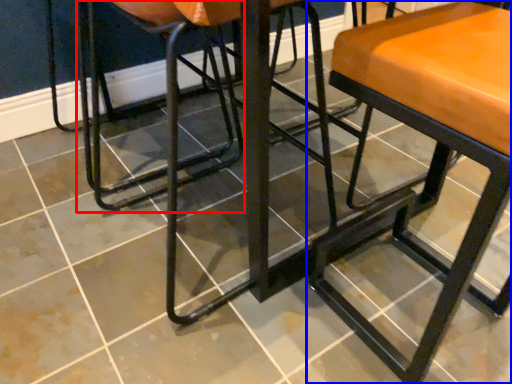
Question: Which point is closer to the camera, swivel chair (highlighted by a red box) or stool (highlighted by a blue box)?

Choices:
 (A) swivel chair
 (B) stool

Answer: (B)